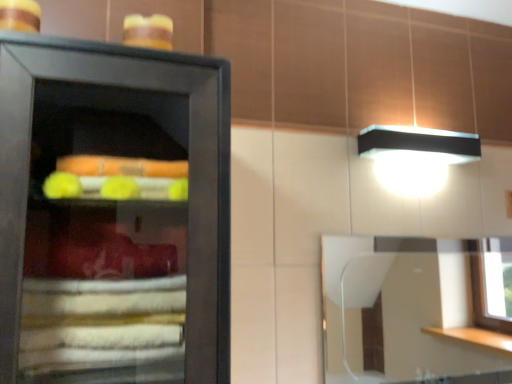
Question: From the image's perspective, is yellow frosted cake at upper left above clear glass mirror at upper right?

Choices:
 (A) no
 (B) yes

Answer: (B)

Question: Is yellow frosted cake at upper left positioned in front of clear glass mirror at upper right?

Choices:
 (A) no
 (B) yes

Answer: (B)

Question: From a real-world perspective, is yellow frosted cake at upper left on top of clear glass mirror at upper right?

Choices:
 (A) no
 (B) yes

Answer: (B)

Question: Is yellow frosted cake at upper left in contact with clear glass mirror at upper right?

Choices:
 (A) no
 (B) yes

Answer: (A)

Question: Is yellow frosted cake at upper left taller than clear glass mirror at upper right?

Choices:
 (A) no
 (B) yes

Answer: (A)

Question: From a real-world perspective, is yellow frosted cake at upper left beneath clear glass mirror at upper right?

Choices:
 (A) no
 (B) yes

Answer: (A)

Question: Does clear glass mirror at upper right lie in front of yellow frosted cake at upper left?

Choices:
 (A) no
 (B) yes

Answer: (A)

Question: Would you say clear glass mirror at upper right is a long distance from yellow frosted cake at upper left?

Choices:
 (A) no
 (B) yes

Answer: (B)

Question: Considering the relative sizes of clear glass mirror at upper right and yellow frosted cake at upper left in the image provided, is clear glass mirror at upper right shorter than yellow frosted cake at upper left?

Choices:
 (A) no
 (B) yes

Answer: (A)

Question: From a real-world perspective, is clear glass mirror at upper right beneath yellow frosted cake at upper left?

Choices:
 (A) no
 (B) yes

Answer: (B)

Question: From a real-world perspective, is clear glass mirror at upper right physically above yellow frosted cake at upper left?

Choices:
 (A) no
 (B) yes

Answer: (A)

Question: Is clear glass mirror at upper right wider than yellow frosted cake at upper left?

Choices:
 (A) yes
 (B) no

Answer: (B)

Question: Does point (505, 317) appear closer or farther from the camera than point (130, 44)?

Choices:
 (A) closer
 (B) farther

Answer: (B)